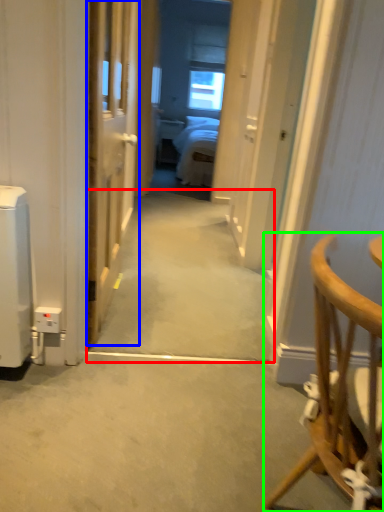
Question: Which is farther away from path (highlighted by a red box)? door (highlighted by a blue box) or chair (highlighted by a green box)?

Choices:
 (A) door
 (B) chair

Answer: (B)